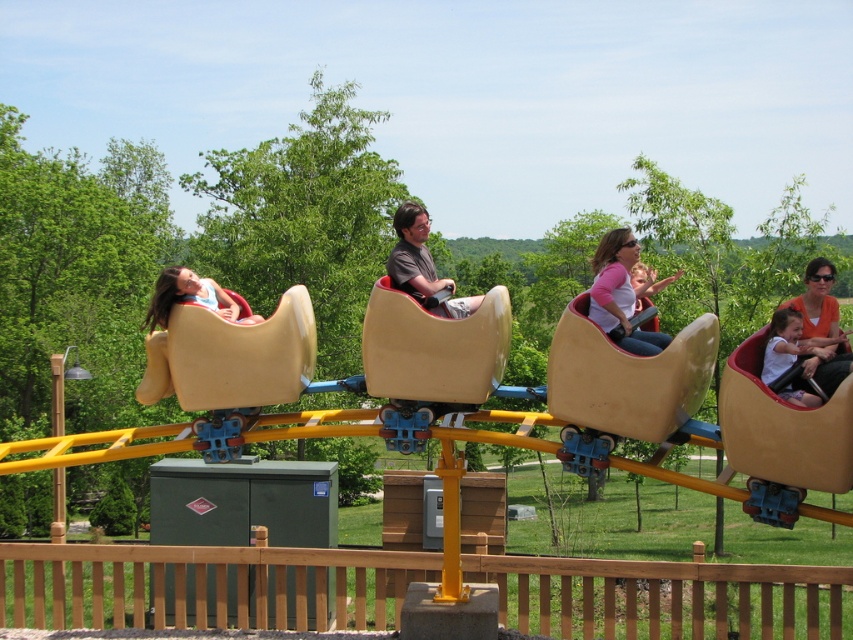
Question: Is orange cotton shirt at center bigger than matte red cushion at left?

Choices:
 (A) no
 (B) yes

Answer: (A)

Question: Which point is closer to the camera?

Choices:
 (A) orange cotton shirt at center
 (B) wooden fence at lower center
 (C) matte brown helmet at center
 (D) matte yellow helmet at center

Answer: (D)

Question: Does matte brown helmet at center have a lesser width compared to matte red cushion at left?

Choices:
 (A) yes
 (B) no

Answer: (A)

Question: Which of these objects is positioned farthest from the orange cotton shirt at center?

Choices:
 (A) wooden fence at lower center
 (B) matte brown helmet at center
 (C) matte yellow helmet at center
 (D) matte yellow slide at left

Answer: (A)

Question: Which point is farther to the camera?

Choices:
 (A) (233, 300)
 (B) (166, 342)

Answer: (A)

Question: Is wooden fence at lower center above orange cotton shirt at center?

Choices:
 (A) no
 (B) yes

Answer: (A)